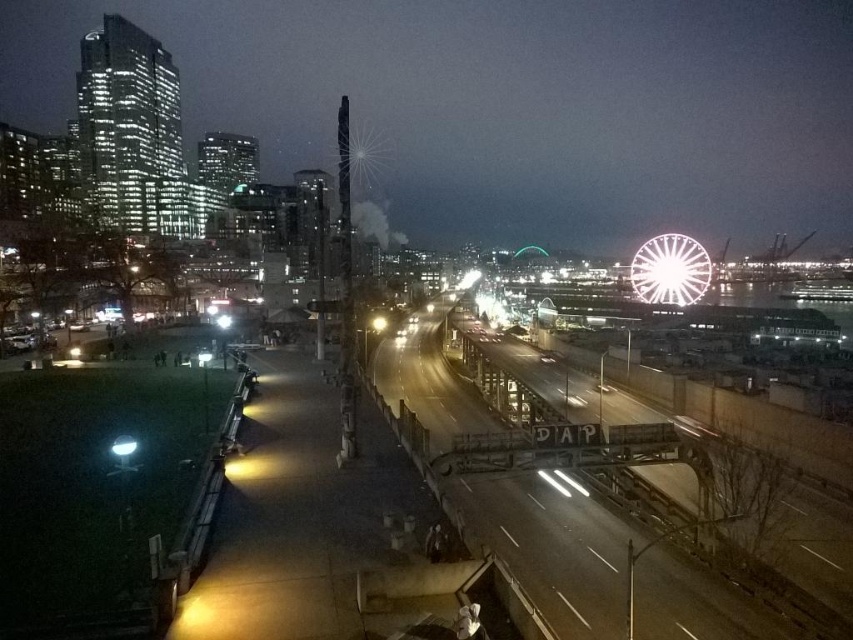
Question: Considering the relative positions of metallic bridge at center and bright white metallic ferris wheel at upper right in the image provided, where is metallic bridge at center located with respect to bright white metallic ferris wheel at upper right?

Choices:
 (A) below
 (B) above

Answer: (A)

Question: From the image, what is the correct spatial relationship of metallic bridge at center in relation to bright white metallic ferris wheel at upper right?

Choices:
 (A) above
 (B) below

Answer: (B)

Question: Among these points, which one is nearest to the camera?

Choices:
 (A) (636, 291)
 (B) (643, 563)

Answer: (B)

Question: Which point is closer to the camera?

Choices:
 (A) metallic bridge at center
 (B) bright white metallic ferris wheel at upper right

Answer: (A)

Question: Does metallic bridge at center appear under bright white metallic ferris wheel at upper right?

Choices:
 (A) no
 (B) yes

Answer: (B)